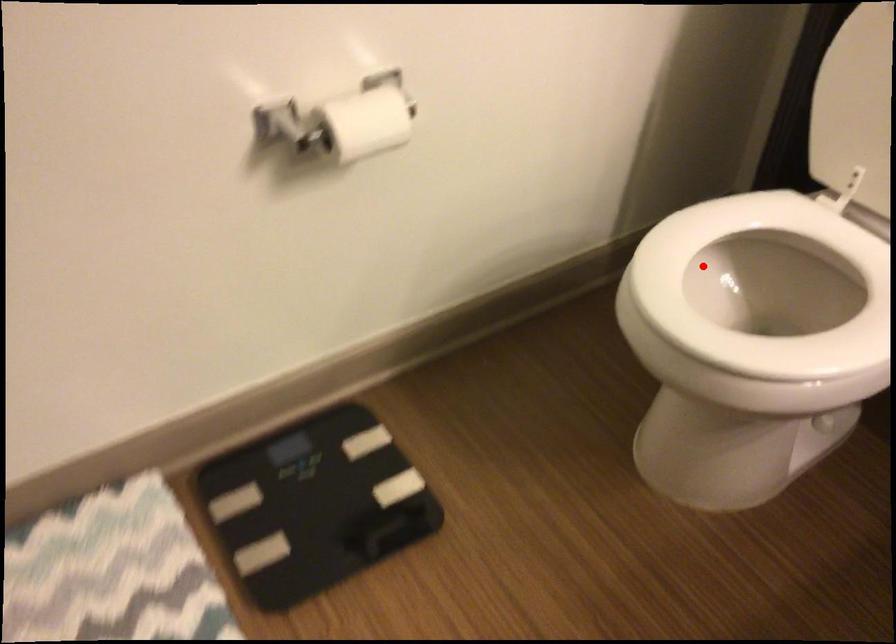
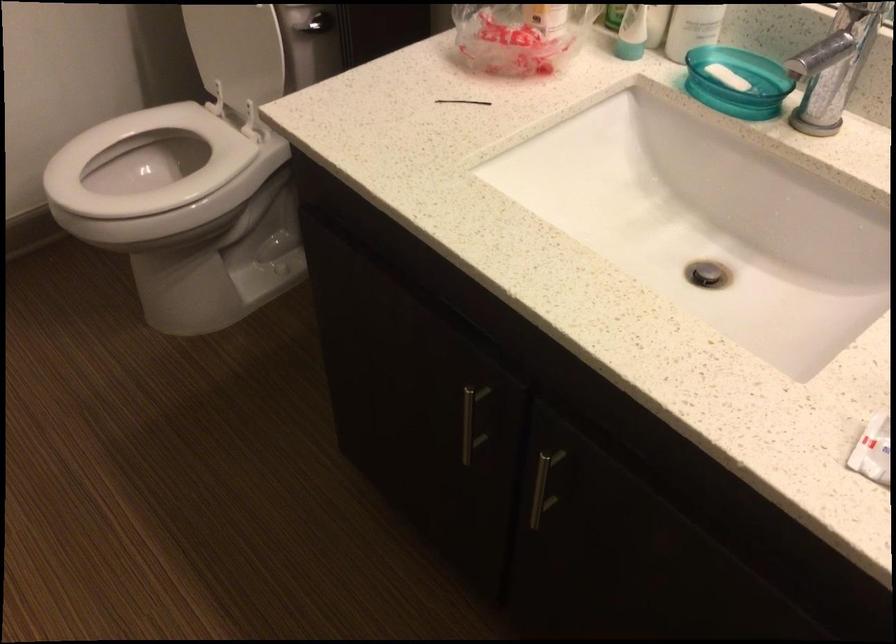
Where in the second image is the point corresponding to the highlighted location from the first image?

(144, 163)